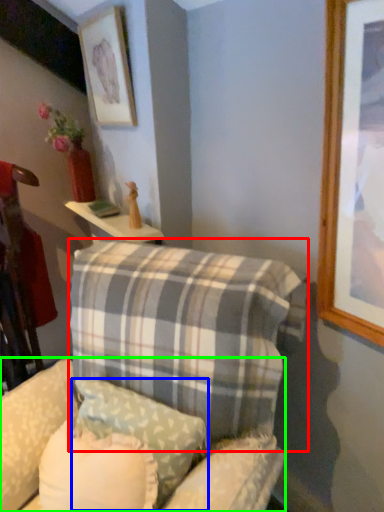
Question: Estimate the real-world distances between objects in this image. Which object is farther from pillow (highlighted by a red box), pillow (highlighted by a blue box) or swivel chair (highlighted by a green box)?

Choices:
 (A) pillow
 (B) swivel chair

Answer: (B)